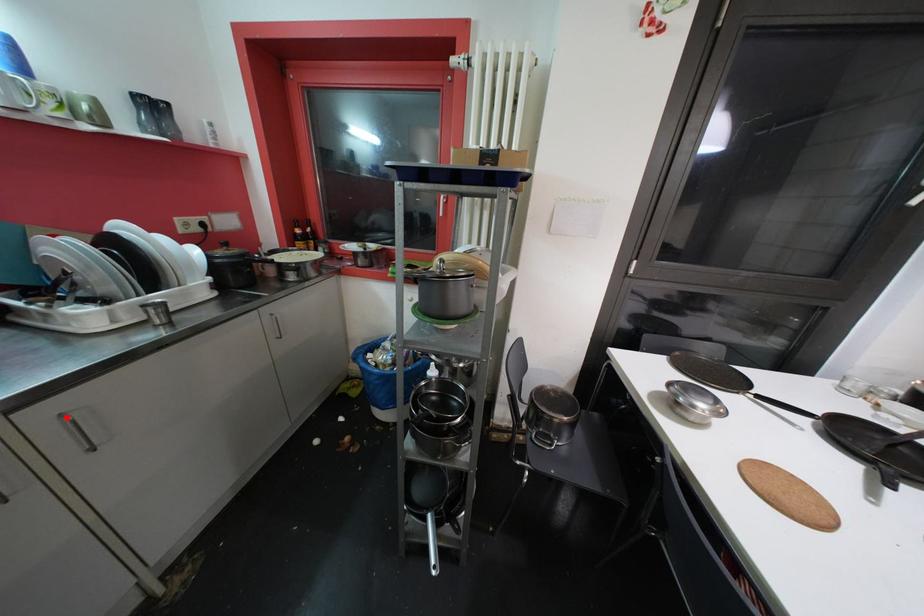
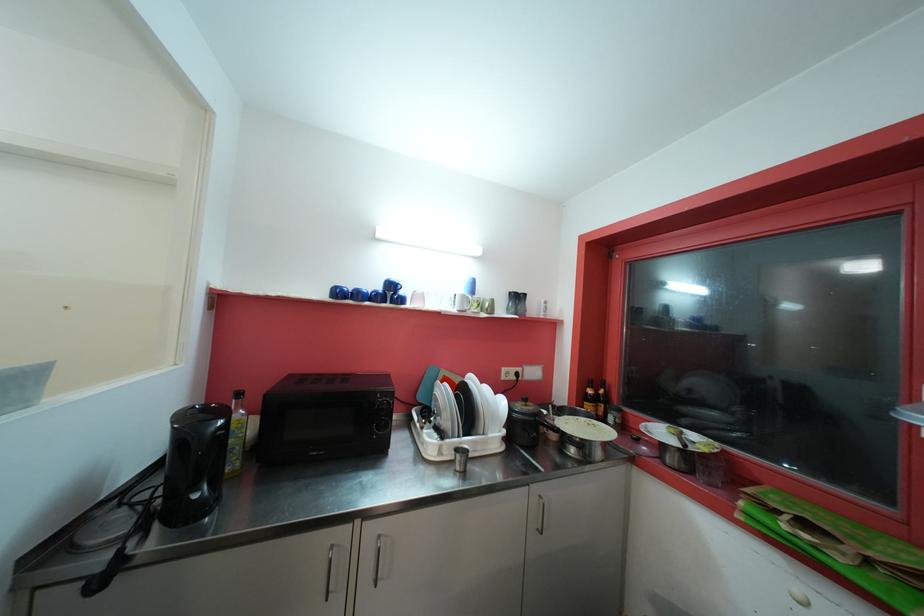
In the second image, find the point that corresponds to the highlighted location in the first image.

(383, 539)